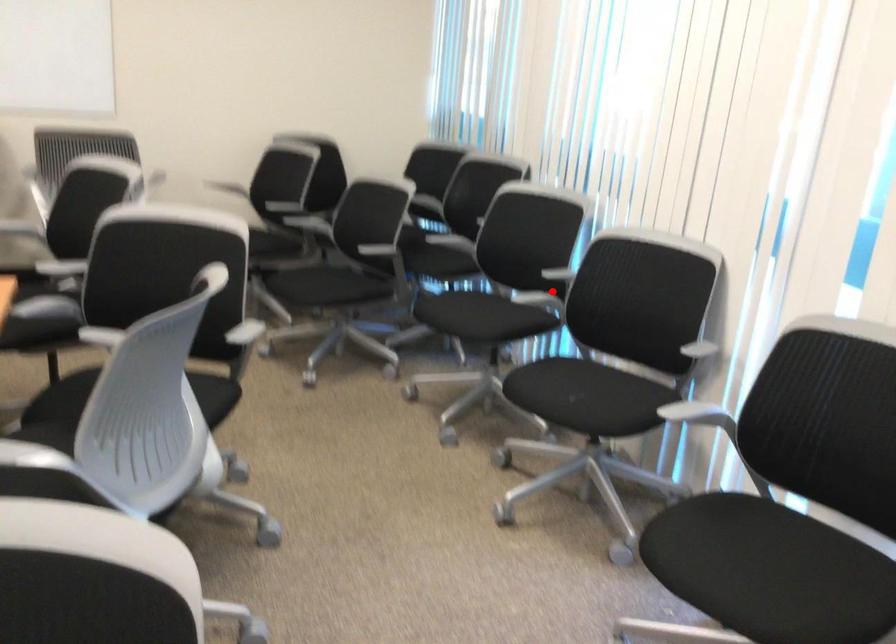
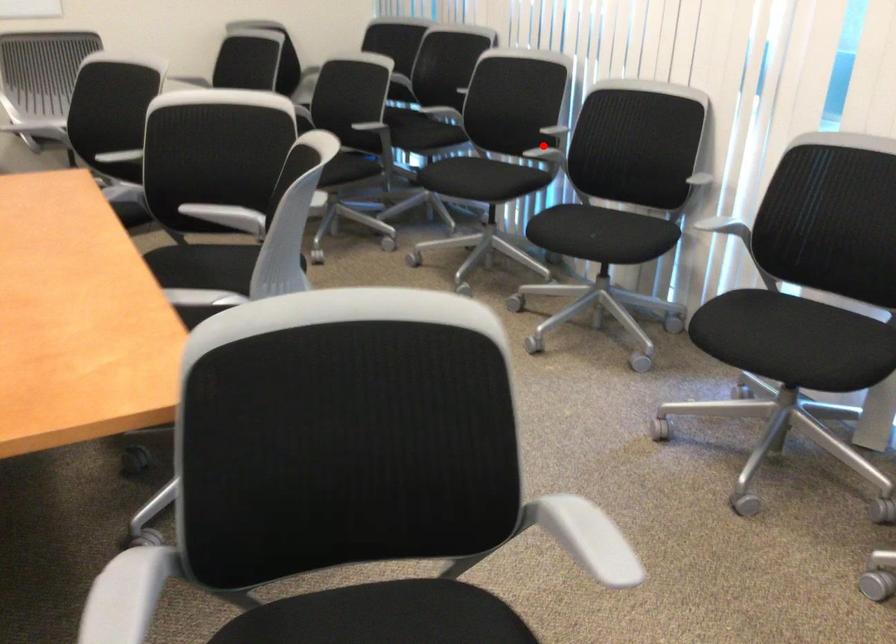
I am providing you with two images of the same scene from different viewpoints. A red point is marked on the first image and another point is marked on the second image. Does the point marked in image1 correspond to the same location as the one in image2?

Yes